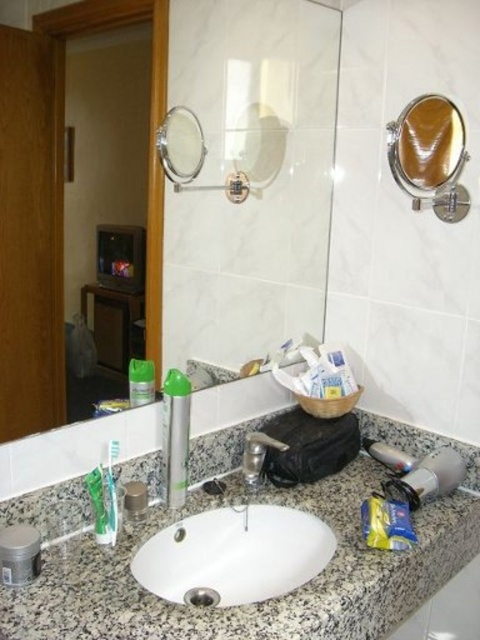
Between matte silver mirror at upper center and satin gold mirror at upper right, which one is positioned higher?

satin gold mirror at upper right is above.

Can you confirm if matte silver mirror at upper center is bigger than satin gold mirror at upper right?

Yes.

Who is more forward, (48, 120) or (452, 156)?

Point (48, 120)

You are a GUI agent. You are given a task and a screenshot of the screen. Output one action in this format:
    pyautogui.click(x=<x>, y=<y>)
    Task: Click on the matte silver mirror at upper center
    
    Given the screenshot: What is the action you would take?
    pyautogui.click(x=56, y=204)

Between granite countertop at center and satin gold mirror at upper right, which one has less height?

With less height is satin gold mirror at upper right.

Does granite countertop at center have a greater width compared to satin gold mirror at upper right?

Yes.

Where is `granite countertop at center`? This screenshot has height=640, width=480. granite countertop at center is located at coordinates (268, 600).

Identify the location of granite countertop at center. (268, 600).

Is point (415, 164) more distant than point (92, 509)?

Yes, it is behind point (92, 509).

Where is `satin gold mirror at upper right`? This screenshot has width=480, height=640. satin gold mirror at upper right is located at coordinates (427, 147).